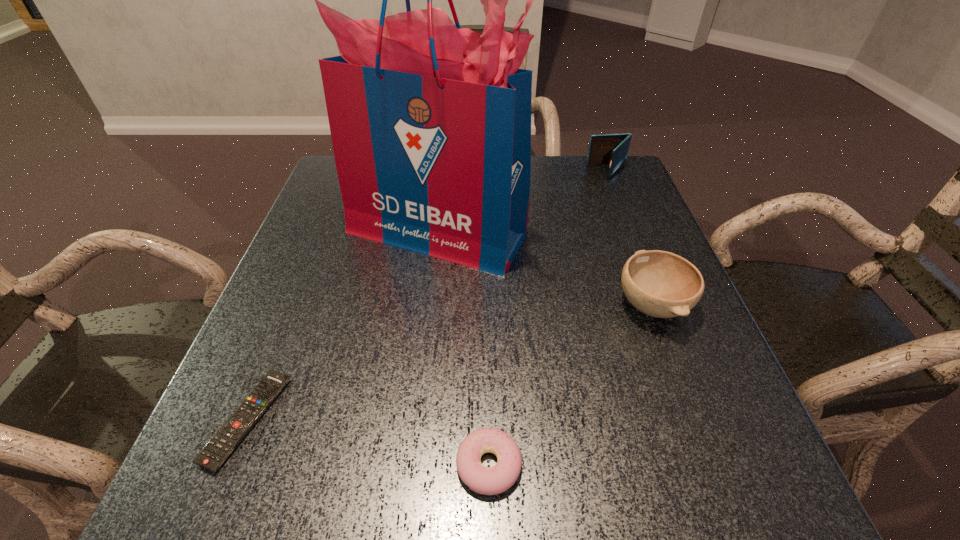
Image resolution: width=960 pixels, height=540 pixels. In order to click on object identified as the third closest to the wallet in this screenshot , I will do `click(493, 480)`.

Image resolution: width=960 pixels, height=540 pixels. Find the location of `free space that satisfies the following two spatial constraints: 1. on the exterior surface of the farthest object; 2. on the front-facing side of the tallest object`. free space that satisfies the following two spatial constraints: 1. on the exterior surface of the farthest object; 2. on the front-facing side of the tallest object is located at coordinates (633, 232).

Where is `free space that satisfies the following two spatial constraints: 1. on the front-facing side of the tallest object; 2. on the right side of the bowl`? free space that satisfies the following two spatial constraints: 1. on the front-facing side of the tallest object; 2. on the right side of the bowl is located at coordinates (428, 305).